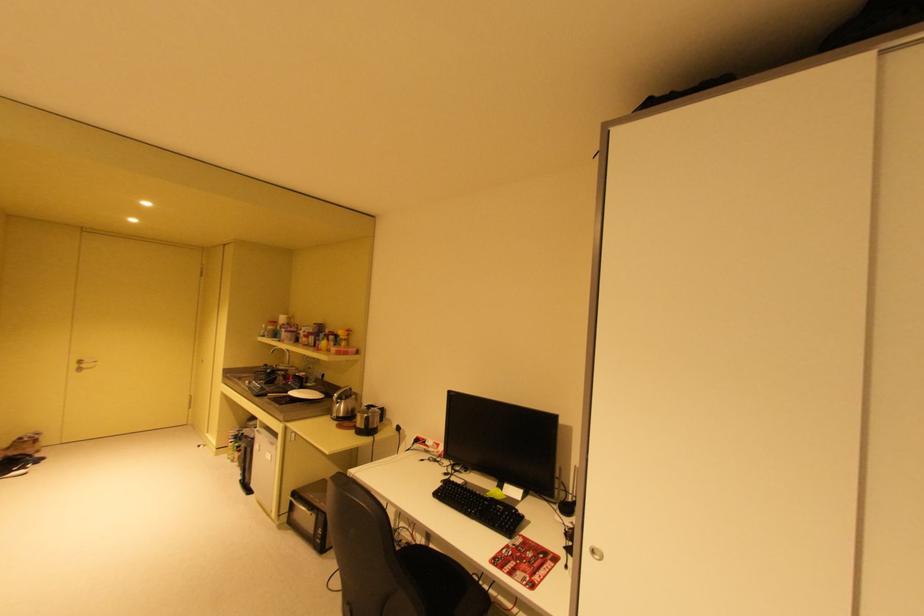
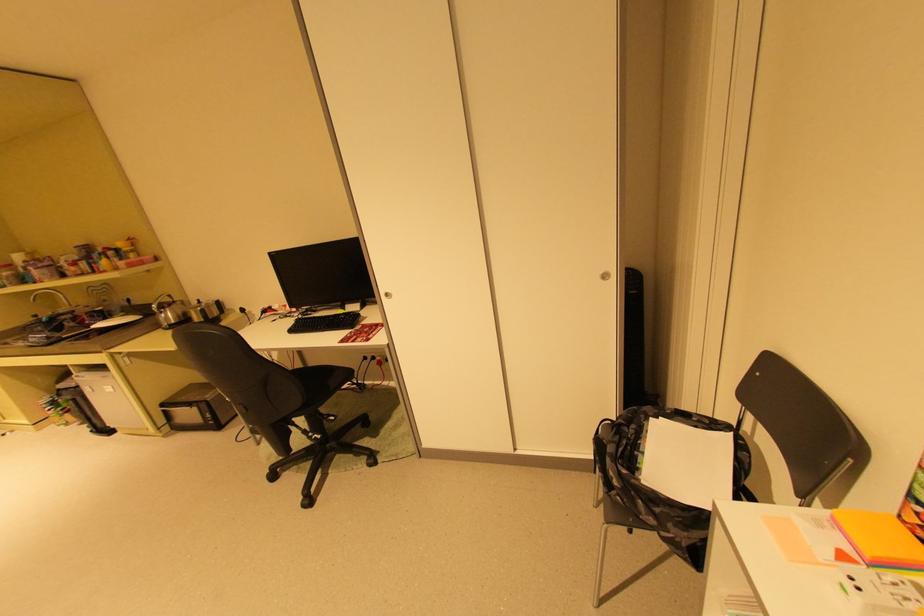
Find the pixel in the second image that matches the point at 290,363 in the first image.

(69, 308)